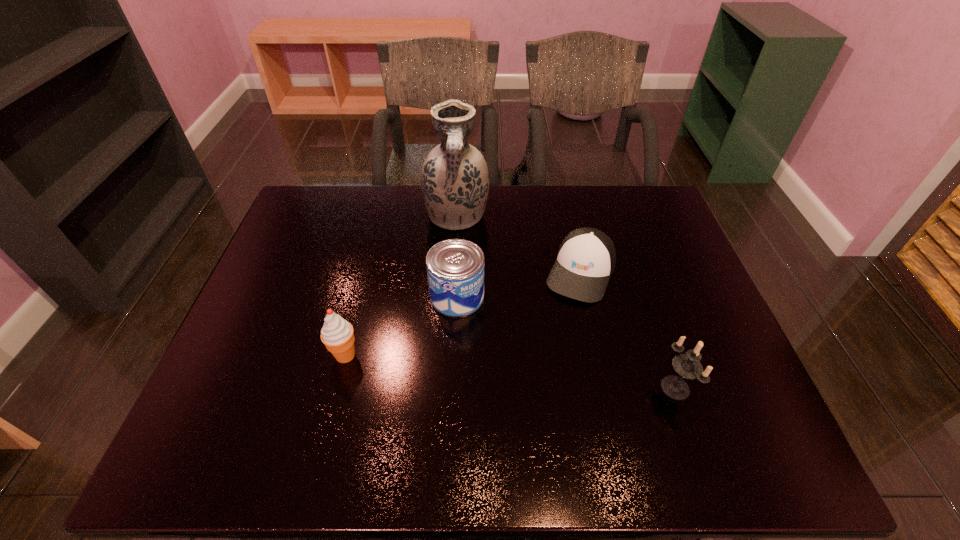
Where is `free spot on the desktop that is between the leftmost object and the candle holder and is positioned on the front panel of the shortest object`? free spot on the desktop that is between the leftmost object and the candle holder and is positioned on the front panel of the shortest object is located at coordinates (538, 374).

Identify the location of vacant space on the desktop that is between the icecream and the rightmost object and is positioned with the handle on the side of the tallest object. (476, 368).

The width and height of the screenshot is (960, 540). I want to click on free spot on the desktop that is between the icecream and the rightmost object and is positioned on the front label of the fourth tallest object, so click(511, 371).